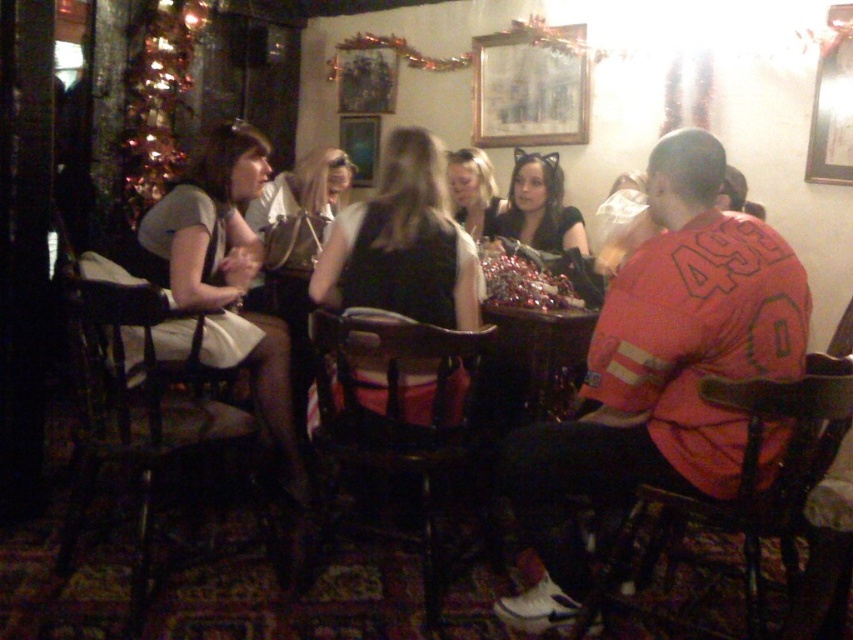
Question: Which point is farther to the camera?

Choices:
 (A) smooth black dress at center
 (B) blonde hair at center

Answer: (A)

Question: Which point is farther to the camera?

Choices:
 (A) black matte dress at center
 (B) matte black dress at center

Answer: (B)

Question: Observing the image, what is the correct spatial positioning of black matte dress at center in reference to matte black dress at center?

Choices:
 (A) left
 (B) right

Answer: (A)

Question: Considering the relative positions of matte black dress at center and blonde hair at center in the image provided, where is matte black dress at center located with respect to blonde hair at center?

Choices:
 (A) above
 (B) below

Answer: (B)

Question: Among these objects, which one is nearest to the camera?

Choices:
 (A) red jersey at center
 (B) matte black dress at center
 (C) blonde hair at center

Answer: (A)

Question: From the image, what is the correct spatial relationship of blonde hair at center in relation to smooth black dress at center?

Choices:
 (A) above
 (B) below

Answer: (B)